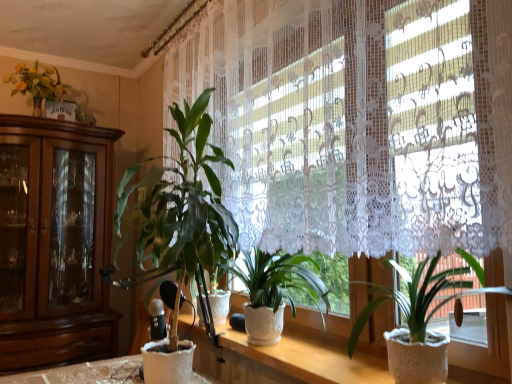
Question: From the image's perspective, is green matte plant at center, the 3th houseplant in the right-to-left sequence, above or below white textured pot at center, the first houseplant positioned from the right?

Choices:
 (A) above
 (B) below

Answer: (A)

Question: Would you say green matte plant at center, the 3th houseplant in the right-to-left sequence, is to the left or to the right of white textured pot at center, the first houseplant positioned from the right, in the picture?

Choices:
 (A) left
 (B) right

Answer: (A)

Question: Estimate the real-world distances between objects in this image. Which object is closer to the white textured pot at center, the first houseplant positioned from the right?

Choices:
 (A) white textured pot at center, which is counted as the 2th houseplant, starting from the left
 (B) white lace curtain at upper center
 (C) white textured pot at center
 (D) green matte plant at center, the 1th houseplant in the left-to-right sequence

Answer: (C)

Question: Which of these objects is positioned closest to the white textured pot at center?

Choices:
 (A) white textured pot at center, which appears as the third houseplant when viewed from the left
 (B) white lace curtain at upper center
 (C) white textured pot at center, which is counted as the 2th houseplant, starting from the left
 (D) green matte plant at center, the 3th houseplant in the right-to-left sequence

Answer: (C)